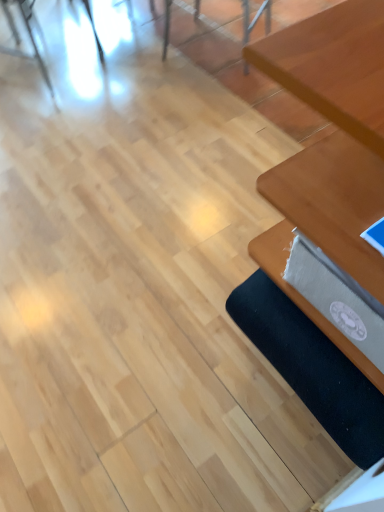
At what (x,y) coordinates should I click in order to perform the action: click on free area in between wooden chair at upper center, which is counted as the 2th chair, starting from the left, and metallic silver chair at upper left, which is the second chair from right to left. Please return your answer as a coordinate pair (x, y). The image size is (384, 512). Looking at the image, I should click on (139, 69).